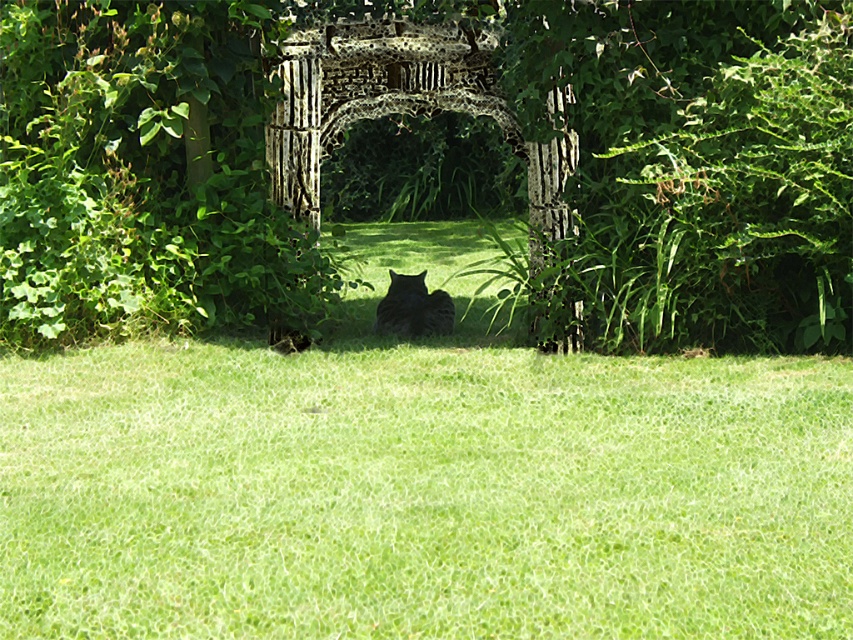
You are a photographer trying to capture a clear shot of the dark gray fur cat at center. However, the wooden lattice archway at center is blocking your view. Can you adjust your position to see the cat without the archway obstructing the view?

The wooden lattice archway at center is in front of the dark gray fur cat at center, so moving to the side or adjusting your angle might allow you to see the cat without the archway blocking the view.

You are a delivery robot that is 0.8 meters wide. You need to move from the wooden lattice archway at center to the dark gray fur cat at center. Is there enough space for you to pass through the area between them?

The wooden lattice archway at center is 1.35 meters away from the dark gray fur cat at center. Since the robot is 0.8 meters wide, there is sufficient space between them for the robot to pass through.

You are a photographer trying to capture a photo of the dark gray fur cat at center. The green leafy bush at right is blocking part of the cat. Can you move the bush to the side to get a clear shot?

The green leafy bush at right is larger than the dark gray fur cat at center, so it would be difficult to move it out of the way easily.